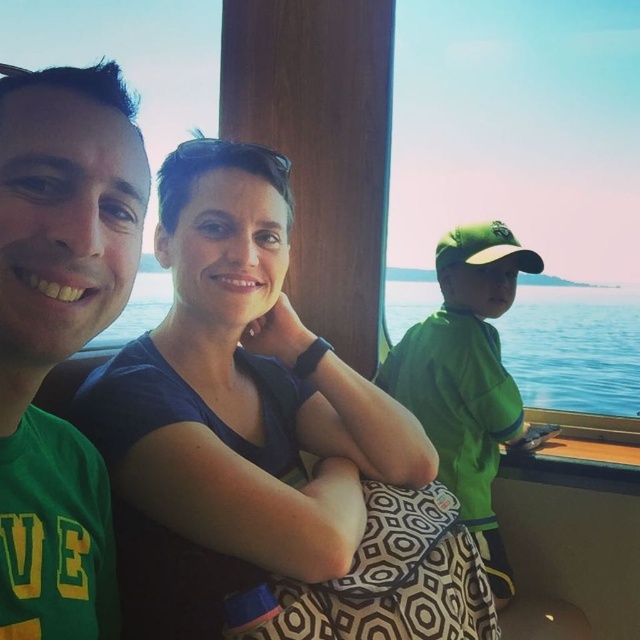
Question: Which object is positioned farthest from the green matte t-shirt at left?

Choices:
 (A) matte blue shirt at center
 (B) blue water at center

Answer: (B)

Question: Which point appears farthest from the camera in this image?

Choices:
 (A) (419, 300)
 (B) (148, 556)

Answer: (A)

Question: Can you confirm if green matte t-shirt at left is positioned to the left of blue water at center?

Choices:
 (A) yes
 (B) no

Answer: (A)

Question: In this image, where is matte blue shirt at center located relative to blue water at center?

Choices:
 (A) above
 (B) below

Answer: (A)

Question: Which of these objects is positioned closest to the green matte t-shirt at left?

Choices:
 (A) matte blue shirt at center
 (B) blue water at center

Answer: (A)

Question: Is green matte t-shirt at left thinner than blue water at center?

Choices:
 (A) no
 (B) yes

Answer: (B)